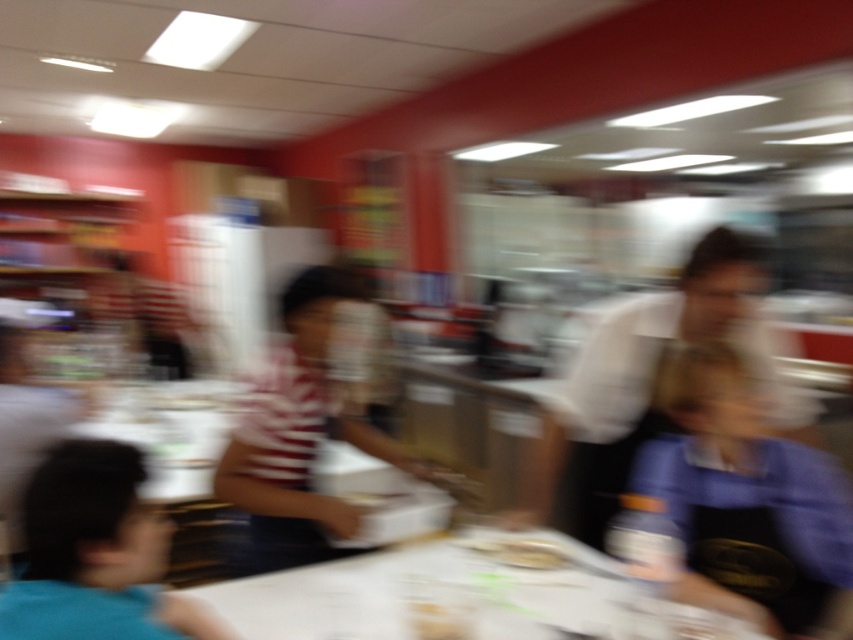
Question: Is white paper table at center positioned behind white striped shirt at center?

Choices:
 (A) no
 (B) yes

Answer: (A)

Question: Is blue fabric shirt at right smaller than white striped shirt at center?

Choices:
 (A) yes
 (B) no

Answer: (A)

Question: Where is blue fabric shirt at lower left located in relation to smooth white plate at center in the image?

Choices:
 (A) below
 (B) above

Answer: (B)

Question: Which object is positioned closest to the smooth white plate at center?

Choices:
 (A) white paper table at center
 (B) white matte shirt at center
 (C) blue fabric shirt at lower left
 (D) white striped shirt at center

Answer: (A)

Question: Among these points, which one is nearest to the camera?

Choices:
 (A) click(x=312, y=413)
 (B) click(x=102, y=532)
 (C) click(x=734, y=445)

Answer: (B)

Question: Which is nearer to the white paper table at center?

Choices:
 (A) blue fabric shirt at lower left
 (B) blue fabric shirt at right
 (C) white striped shirt at center
 (D) white matte shirt at center

Answer: (B)